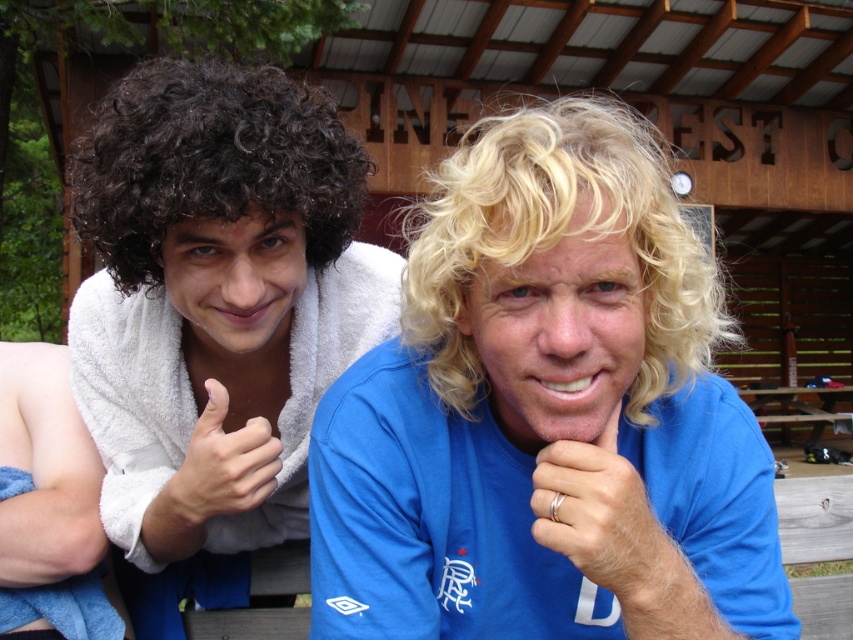
Question: Does silver metallic ring at lower center have a greater width compared to wooden picnic table at center?

Choices:
 (A) no
 (B) yes

Answer: (A)

Question: Which of the following is the farthest from the observer?

Choices:
 (A) (74, 221)
 (B) (563, 472)

Answer: (A)

Question: Which point is farther to the camera?

Choices:
 (A) (62, 440)
 (B) (492, 140)

Answer: (A)

Question: Does blue towel at left have a larger size compared to white towel at left?

Choices:
 (A) yes
 (B) no

Answer: (A)

Question: Does silver metallic ring at lower center have a smaller size compared to white towel at left?

Choices:
 (A) yes
 (B) no

Answer: (A)

Question: Which of the following is the farthest from the observer?

Choices:
 (A) (453, 268)
 (B) (136, 100)
 (C) (224, 419)

Answer: (C)